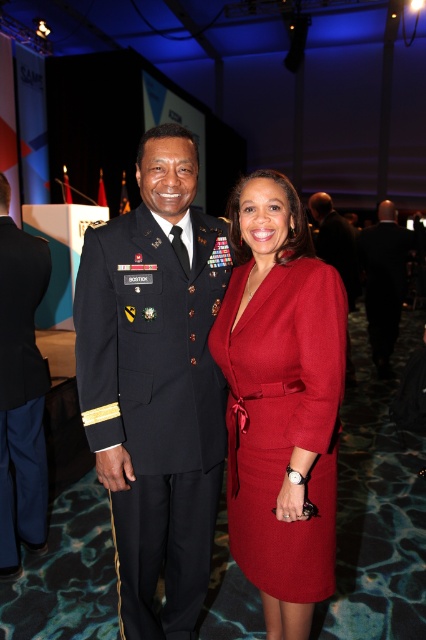
Question: Does matte black military uniform at center appear on the left side of dark blue wool military uniform at left?

Choices:
 (A) no
 (B) yes

Answer: (A)

Question: Among these points, which one is farthest from the camera?

Choices:
 (A) (282, 184)
 (B) (2, 253)
 (C) (213, 321)

Answer: (B)

Question: Does matte red dress at center appear under matte black suit at center?

Choices:
 (A) no
 (B) yes

Answer: (B)

Question: Which object is farther from the camera taking this photo?

Choices:
 (A) matte black military uniform at center
 (B) dark blue wool military uniform at left
 (C) black wool suit at right
 (D) matte black suit at center

Answer: (C)

Question: Is matte red dress at center bigger than matte black suit at center?

Choices:
 (A) yes
 (B) no

Answer: (B)

Question: Which point appears closest to the camera in this image?

Choices:
 (A) (377, 312)
 (B) (78, 316)
 (C) (311, 216)
 (D) (299, 586)

Answer: (D)